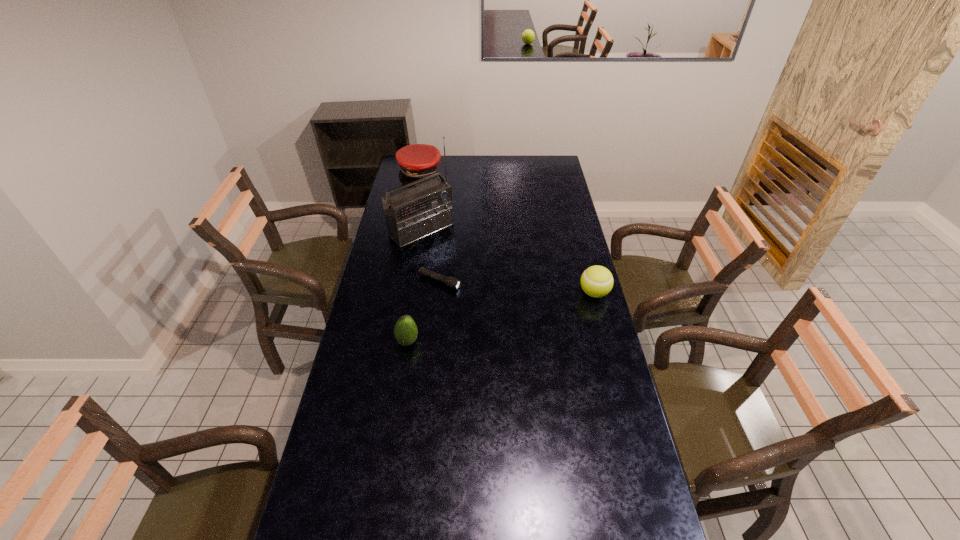
This screenshot has height=540, width=960. I want to click on empty location between the nearest object and the farthest object, so [414, 257].

What are the coordinates of `free space between the shortest object and the rightmost object` in the screenshot? It's located at (517, 287).

Identify the location of vacant space in between the tallest object and the tennis ball. This screenshot has height=540, width=960. (508, 261).

What are the coordinates of `vacant space in between the avocado and the flashlight` in the screenshot? It's located at (423, 312).

This screenshot has height=540, width=960. In order to click on unoccupied position between the tennis ball and the tallest object in this screenshot , I will do (x=508, y=261).

The height and width of the screenshot is (540, 960). Find the location of `unoccupied area between the tennis ball and the cap`. unoccupied area between the tennis ball and the cap is located at coordinates (507, 233).

Identify the location of vacant area between the tallest object and the nearest object. (415, 286).

Select which object is the second closest to the shortest object. Please provide its 2D coordinates. Your answer should be formatted as a tuple, i.e. [(x, y)], where the tuple contains the x and y coordinates of a point satisfying the conditions above.

[(405, 331)]

Point out which object is positioned as the second nearest to the shortest object. Please provide its 2D coordinates. Your answer should be formatted as a tuple, i.e. [(x, y)], where the tuple contains the x and y coordinates of a point satisfying the conditions above.

[(405, 331)]

You are a GUI agent. You are given a task and a screenshot of the screen. Output one action in this format:
    pyautogui.click(x=<x>, y=<y>)
    Task: Click on the vacant space that satisfies the following two spatial constraints: 1. on the front side of the tennis ball; 2. on the right side of the shortest object
    The image size is (960, 540).
    Given the screenshot: What is the action you would take?
    pyautogui.click(x=439, y=293)